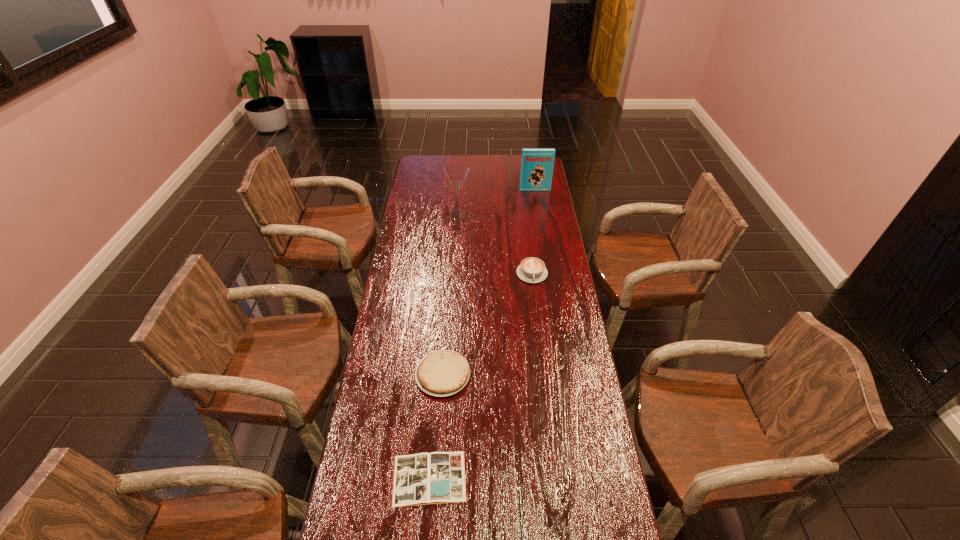
Find the location of a particular element. the fourth nearest object is located at coordinates (457, 175).

Where is `the farther book`? the farther book is located at coordinates click(x=537, y=164).

The width and height of the screenshot is (960, 540). In order to click on the farthest object in this screenshot , I will do `click(537, 164)`.

This screenshot has height=540, width=960. I want to click on the third shortest object, so click(x=532, y=270).

Locate an element on the screen. The image size is (960, 540). the third nearest object is located at coordinates (532, 270).

You are a GUI agent. You are given a task and a screenshot of the screen. Output one action in this format:
    pyautogui.click(x=<x>, y=<y>)
    Task: Click on the fourth tallest object
    
    Given the screenshot: What is the action you would take?
    pyautogui.click(x=441, y=373)

Where is `the second nearest object`? Image resolution: width=960 pixels, height=540 pixels. the second nearest object is located at coordinates (441, 373).

Where is `the nearer book`? This screenshot has width=960, height=540. the nearer book is located at coordinates (438, 477).

Identify the location of the left book. The width and height of the screenshot is (960, 540). (438, 477).

At what (x,y) coordinates should I click in order to perform the action: click on free space located on the front of the second farthest object. Please return your answer as a coordinate pair (x, y). The height and width of the screenshot is (540, 960). Looking at the image, I should click on (455, 279).